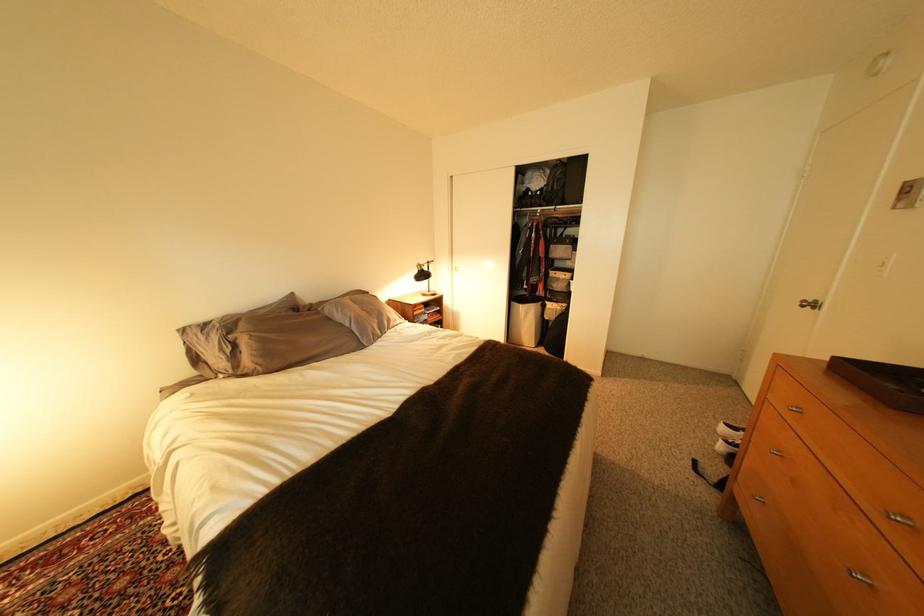
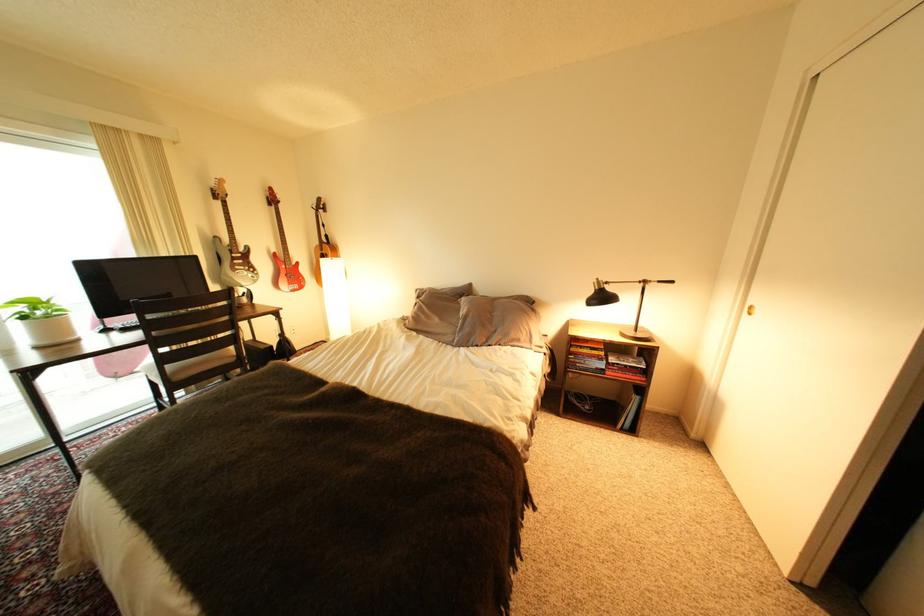
The point at (335, 310) is marked in the first image. Where is the corresponding point in the second image?

(473, 302)